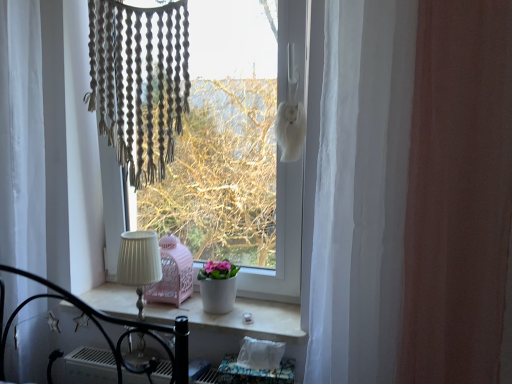
Find the location of a particular element. empty space that is ontop of white ceramic window sill at center (from a real-world perspective) is located at coordinates (212, 314).